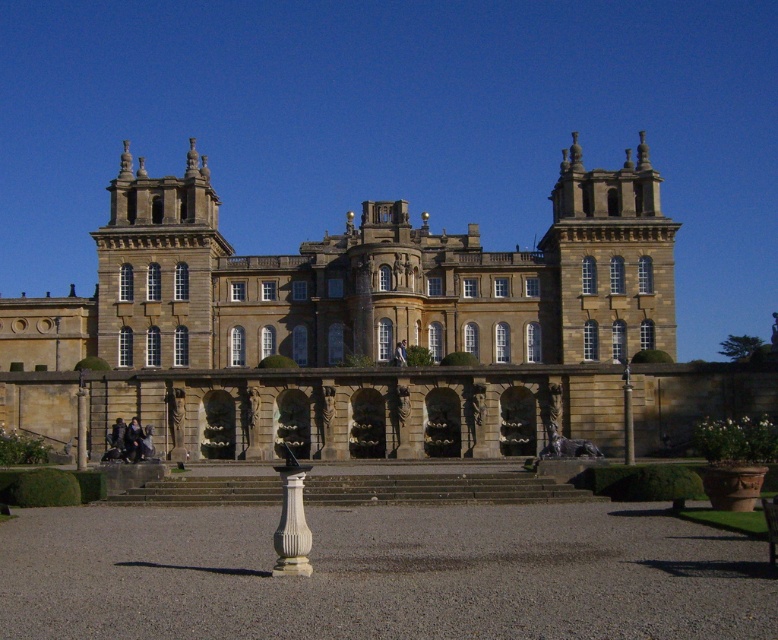
Question: Does brown stone palace at center appear under white marble column at center?

Choices:
 (A) no
 (B) yes

Answer: (A)

Question: Which point is closer to the camera taking this photo?

Choices:
 (A) (303, 548)
 (B) (478, 248)

Answer: (A)

Question: Can you confirm if brown stone palace at center is positioned below white marble column at center?

Choices:
 (A) no
 (B) yes

Answer: (A)

Question: Does brown stone palace at center appear on the left side of white marble column at center?

Choices:
 (A) yes
 (B) no

Answer: (A)